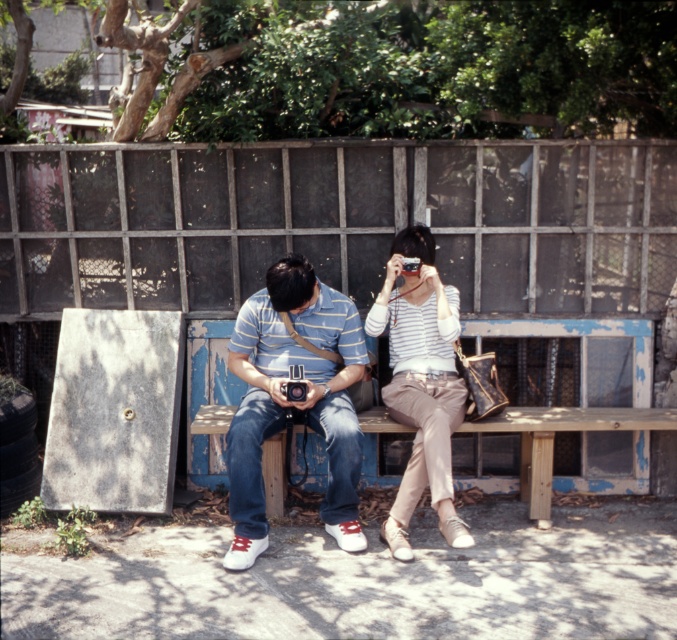
You are a photographer trying to capture both individuals in a single frame. Given their positions and the space they occupy, will you need to adjust your camera angle to include both the matte blue striped shirt at center and the striped cotton shirt at center in the photo?

The matte blue striped shirt at center occupies less space than striped cotton shirt at center, so you will need to adjust your camera angle to ensure both are fully visible in the frame.

You are a photographer trying to decide where to place a new tripod in the scene. The striped cotton shirt at center and the wooden bench at center are already present. Which object would be more suitable for placing the tripod on top of, considering their sizes?

The wooden bench at center has a smaller size compared to the striped cotton shirt at center, so the tripod should be placed on the wooden bench at center since it is more stable and appropriate for supporting the tripod.

You are a photographer trying to capture both the matte blue striped shirt at center and the striped cotton shirt at center in a single frame. Which shirt should you focus on first to ensure both are in the shot?

You should focus on the matte blue striped shirt at center first because it is closer to you than the striped cotton shirt at center, ensuring both are in the frame.